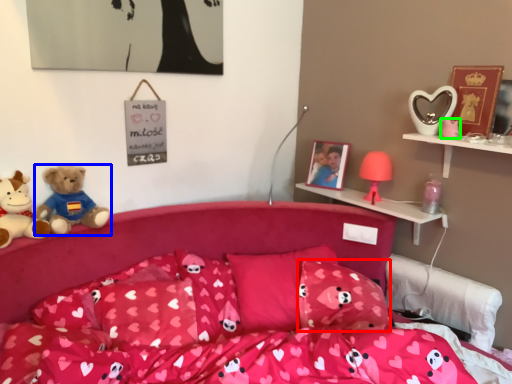
Question: Based on their relative distances, which object is nearer to pillow (highlighted by a red box)? Choose from teddy bear (highlighted by a blue box) and toy (highlighted by a green box).

Choices:
 (A) teddy bear
 (B) toy

Answer: (B)